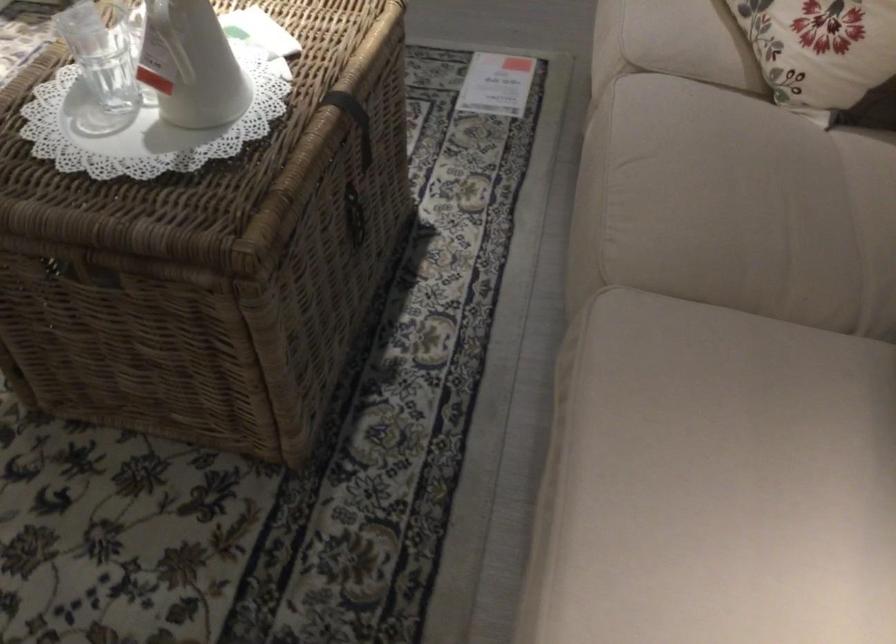
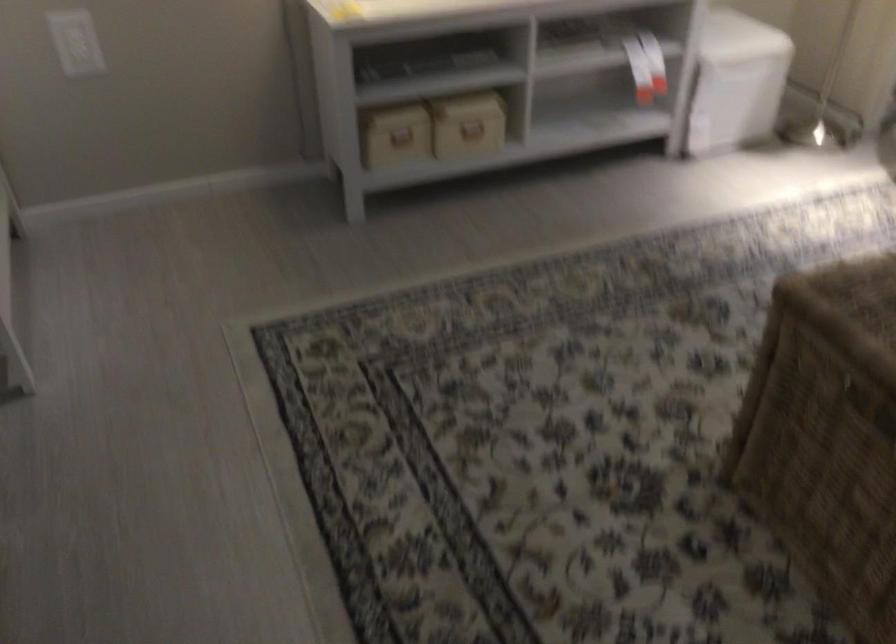
Question: The camera is either moving clockwise (left) or counter-clockwise (right) around the object. The first image is from the beginning of the video and the second image is from the end. Is the camera moving left or right when shooting the video?

Choices:
 (A) Left
 (B) Right

Answer: (B)